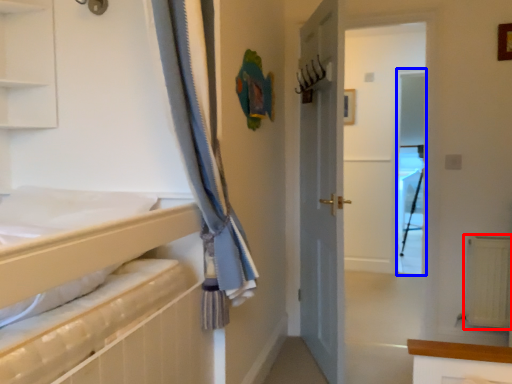
Question: Which point is closer to the camera, radiator (highlighted by a red box) or screen door (highlighted by a blue box)?

Choices:
 (A) radiator
 (B) screen door

Answer: (A)